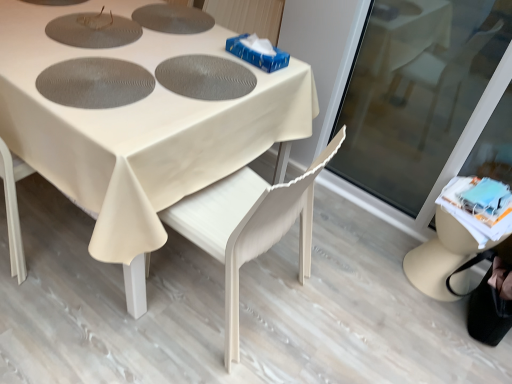
Image resolution: width=512 pixels, height=384 pixels. Identify the location of free space in front of white wood chair at center. click(x=184, y=357).